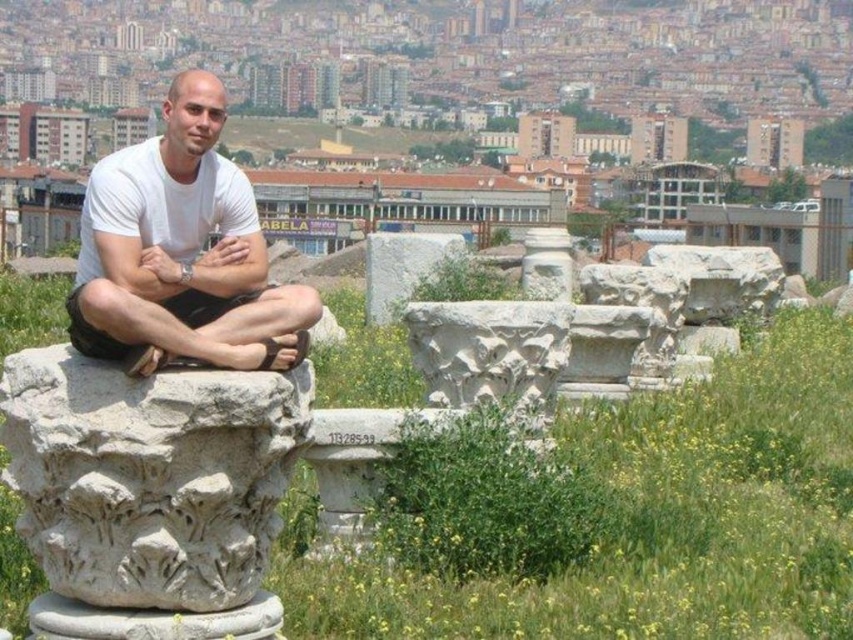
In the scene shown: Is white stone column at center positioned before white matte t-shirt at center?

Yes.

Where is `white stone column at center`? The height and width of the screenshot is (640, 853). white stone column at center is located at coordinates (149, 476).